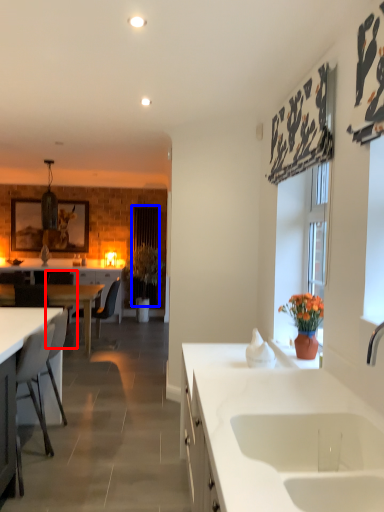
Question: Which of the following is the closest to the observer, armchair (highlighted by a red box) or curtain (highlighted by a blue box)?

Choices:
 (A) armchair
 (B) curtain

Answer: (A)